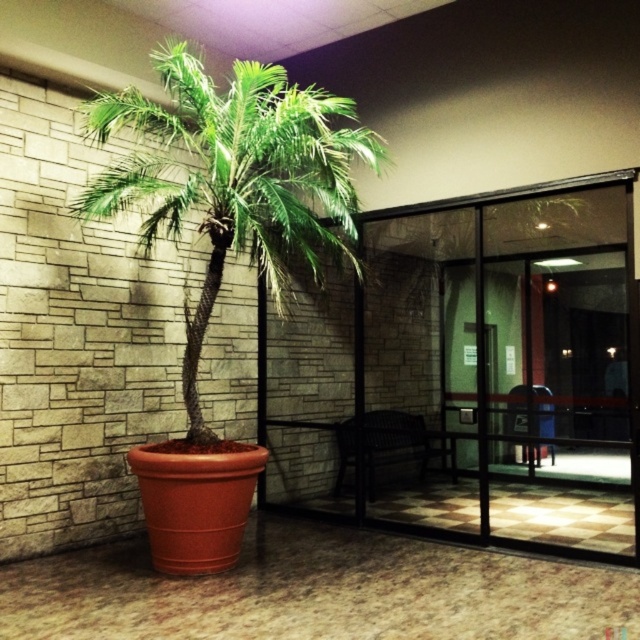
Question: Is transparent glass door at center behind green leafy palm tree at center?

Choices:
 (A) no
 (B) yes

Answer: (B)

Question: Can you confirm if transparent glass door at center is positioned above green leafy palm tree at center?

Choices:
 (A) no
 (B) yes

Answer: (A)

Question: Which point is farther to the camera?

Choices:
 (A) transparent glass door at center
 (B) green leafy palm tree at center

Answer: (A)

Question: Can you confirm if transparent glass door at center is bigger than green leafy palm tree at center?

Choices:
 (A) yes
 (B) no

Answer: (A)

Question: Which of the following is the farthest from the observer?

Choices:
 (A) green leafy palm tree at center
 (B) transparent glass door at center

Answer: (B)

Question: Which point is closer to the camera taking this photo?

Choices:
 (A) (170, 198)
 (B) (346, 504)

Answer: (A)